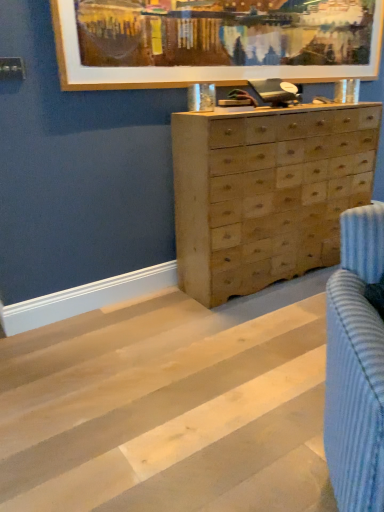
Question: Can you confirm if natural wood floor at center is shorter than wooden frame at upper center?

Choices:
 (A) yes
 (B) no

Answer: (A)

Question: Does natural wood floor at center have a greater height compared to wooden frame at upper center?

Choices:
 (A) yes
 (B) no

Answer: (B)

Question: Could wooden frame at upper center be considered to be inside natural wood floor at center?

Choices:
 (A) no
 (B) yes

Answer: (A)

Question: Can you confirm if natural wood floor at center is positioned to the right of wooden frame at upper center?

Choices:
 (A) yes
 (B) no

Answer: (B)

Question: Is natural wood floor at center smaller than wooden frame at upper center?

Choices:
 (A) yes
 (B) no

Answer: (B)

Question: Considering the positions of point (281, 146) and point (302, 468), is point (281, 146) closer or farther from the camera than point (302, 468)?

Choices:
 (A) closer
 (B) farther

Answer: (B)

Question: Is natural wood chest of drawers at center bigger or smaller than natural wood floor at center?

Choices:
 (A) big
 (B) small

Answer: (A)

Question: From a real-world perspective, is natural wood chest of drawers at center physically located above or below natural wood floor at center?

Choices:
 (A) below
 (B) above

Answer: (B)

Question: Considering their positions, is natural wood chest of drawers at center located in front of or behind natural wood floor at center?

Choices:
 (A) behind
 (B) front

Answer: (A)

Question: From a real-world perspective, relative to natural wood floor at center, is wooden frame at upper center vertically above or below?

Choices:
 (A) above
 (B) below

Answer: (A)

Question: Considering their positions, is wooden frame at upper center located in front of or behind natural wood floor at center?

Choices:
 (A) front
 (B) behind

Answer: (B)

Question: Visually, is wooden frame at upper center positioned to the left or to the right of natural wood floor at center?

Choices:
 (A) right
 (B) left

Answer: (A)

Question: From the image's perspective, is wooden frame at upper center above or below natural wood floor at center?

Choices:
 (A) above
 (B) below

Answer: (A)

Question: Is point (324, 242) positioned closer to the camera than point (324, 9)?

Choices:
 (A) farther
 (B) closer

Answer: (A)

Question: Looking at their shapes, would you say natural wood chest of drawers at center is wider or thinner than wooden frame at upper center?

Choices:
 (A) thin
 (B) wide

Answer: (B)